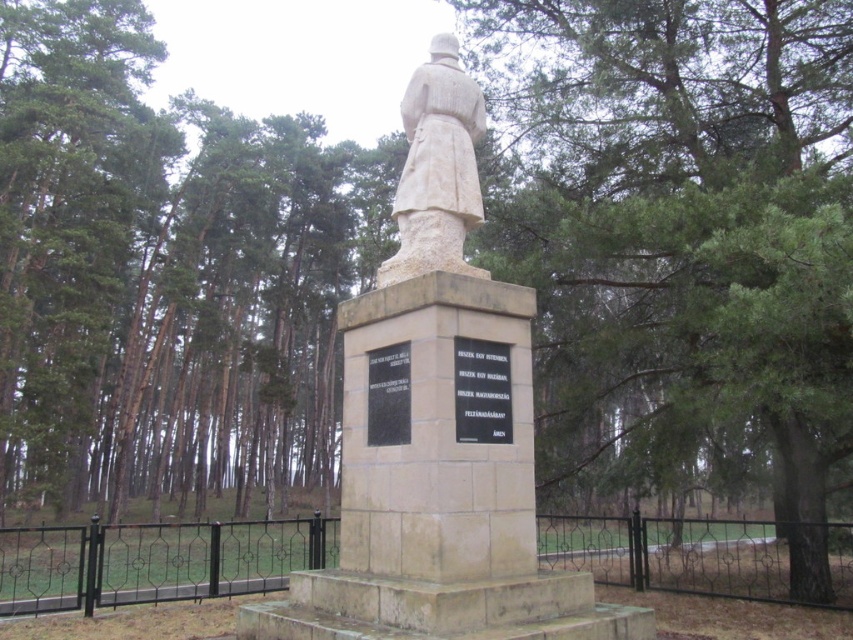
Who is more forward, (839, 576) or (378, 380)?

Point (378, 380) is in front.

Is black wrought iron fence at lower center positioned in front of black polished stone plaque at center?

No.

Which is behind, point (13, 572) or point (384, 424)?

The point (13, 572) is more distant.

This screenshot has width=853, height=640. I want to click on black wrought iron fence at lower center, so click(154, 561).

Can you confirm if black wrought iron fence at lower center is thinner than white stone statue at center?

No, black wrought iron fence at lower center is not thinner than white stone statue at center.

Consider the image. Is black wrought iron fence at lower center bigger than white stone statue at center?

Yes, black wrought iron fence at lower center is bigger than white stone statue at center.

Describe the element at coordinates (154, 561) in the screenshot. This screenshot has height=640, width=853. I see `black wrought iron fence at lower center` at that location.

Where is `black wrought iron fence at lower center`? The image size is (853, 640). black wrought iron fence at lower center is located at coordinates (154, 561).

This screenshot has height=640, width=853. What do you see at coordinates (683, 236) in the screenshot?
I see `green leafy tree at center` at bounding box center [683, 236].

Is green leafy tree at center to the right of black stone plaque at center from the viewer's perspective?

Indeed, green leafy tree at center is positioned on the right side of black stone plaque at center.

This screenshot has height=640, width=853. I want to click on green leafy tree at center, so click(x=683, y=236).